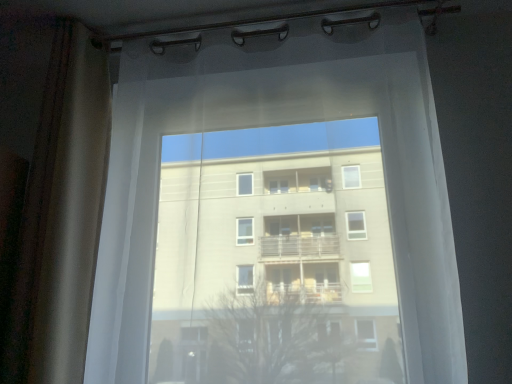
Question: From a real-world perspective, relative to translucent white curtain at center, is brown textured curtain at left vertically above or below?

Choices:
 (A) above
 (B) below

Answer: (A)

Question: Which is correct: brown textured curtain at left is inside translucent white curtain at center, or outside of it?

Choices:
 (A) inside
 (B) outside

Answer: (B)

Question: Is brown textured curtain at left taller or shorter than translucent white curtain at center?

Choices:
 (A) tall
 (B) short

Answer: (A)

Question: From the image's perspective, relative to brown textured curtain at left, is translucent white curtain at center above or below?

Choices:
 (A) above
 (B) below

Answer: (B)

Question: Does point (359, 46) appear closer or farther from the camera than point (13, 102)?

Choices:
 (A) closer
 (B) farther

Answer: (A)

Question: From a real-world perspective, is translucent white curtain at center positioned above or below brown textured curtain at left?

Choices:
 (A) below
 (B) above

Answer: (A)

Question: Considering the positions of translucent white curtain at center and brown textured curtain at left in the image, is translucent white curtain at center wider or thinner than brown textured curtain at left?

Choices:
 (A) thin
 (B) wide

Answer: (B)